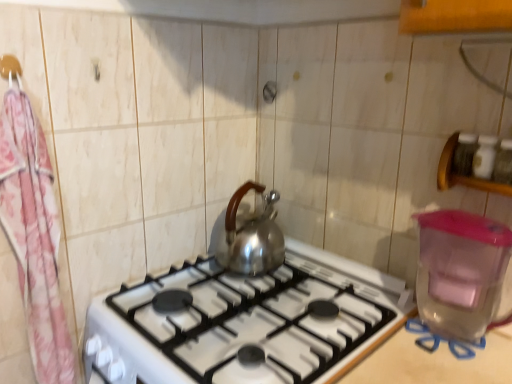
Question: Considering the positions of pink floral fabric at left and pink fabric hanger at upper left in the image, is pink floral fabric at left wider or thinner than pink fabric hanger at upper left?

Choices:
 (A) wide
 (B) thin

Answer: (A)

Question: Is pink floral fabric at left situated inside pink fabric hanger at upper left or outside?

Choices:
 (A) inside
 (B) outside

Answer: (B)

Question: Based on their relative distances, which object is farther from the transparent plastic water heater at right?

Choices:
 (A) pink floral fabric at left
 (B) satin silver gas stove at center
 (C) pink fabric hanger at upper left

Answer: (C)

Question: Considering the real-world distances, which object is farthest from the pink fabric hanger at upper left?

Choices:
 (A) satin silver gas stove at center
 (B) pink floral fabric at left
 (C) transparent plastic water heater at right

Answer: (C)